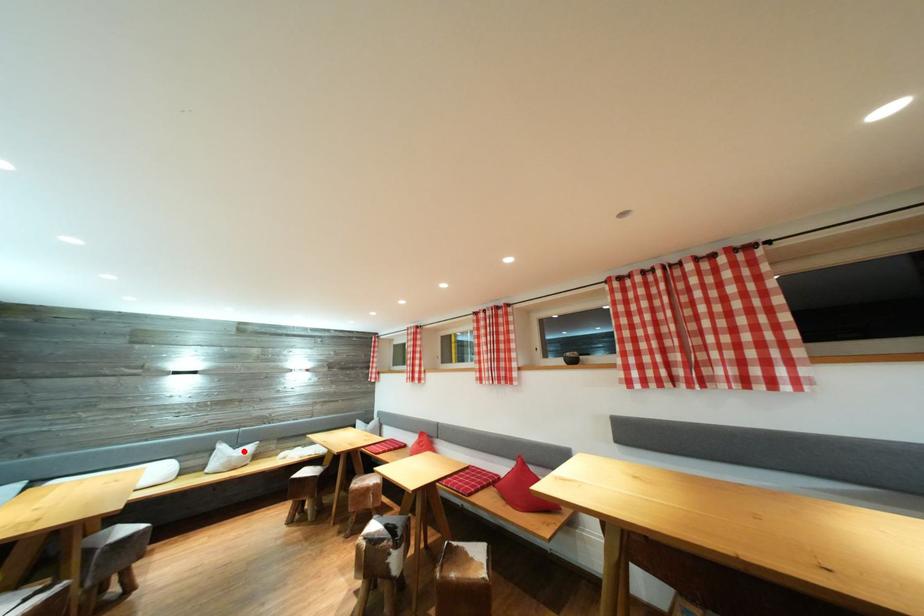
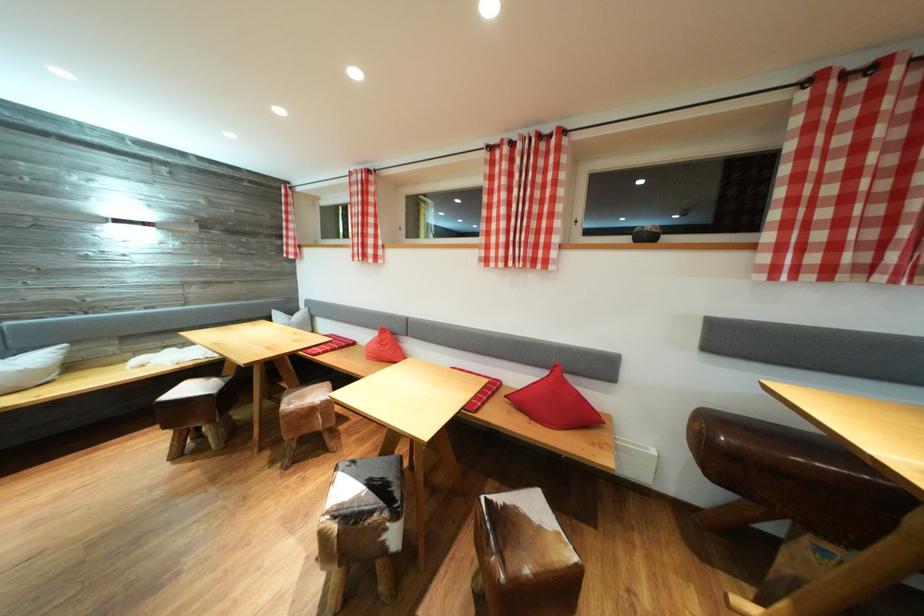
Question: I am providing you with two images of the same scene from different viewpoints. A red point is marked on the first image. Is the red point's position out of view in image 2?

Choices:
 (A) Yes
 (B) No

Answer: (B)